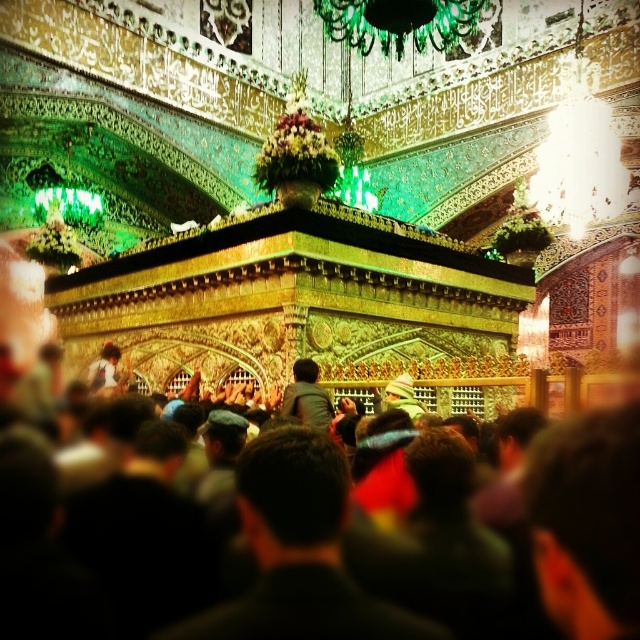
Who is more forward, (544, 544) or (312, 374)?

Point (544, 544) is more forward.

Between black fabric at center and dark gray shirt at center, which one has less height?

Standing shorter between the two is dark gray shirt at center.

Is point (531, 520) positioned after point (312, 384)?

No, it is in front of (312, 384).

The width and height of the screenshot is (640, 640). Find the location of `black fabric at center`. black fabric at center is located at coordinates (580, 518).